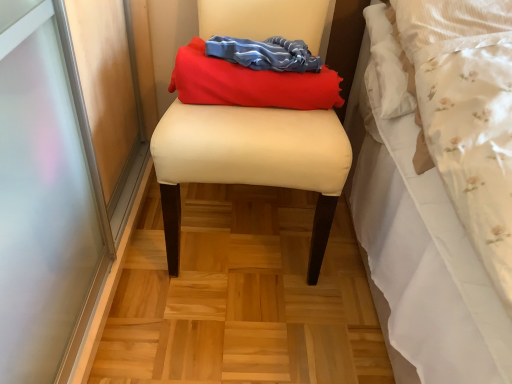
The width and height of the screenshot is (512, 384). I want to click on matte red fabric at center, so click(254, 74).

This screenshot has width=512, height=384. Describe the element at coordinates (254, 74) in the screenshot. I see `matte red fabric at center` at that location.

This screenshot has height=384, width=512. What do you see at coordinates (250, 160) in the screenshot?
I see `beige fabric stool at center` at bounding box center [250, 160].

The height and width of the screenshot is (384, 512). I want to click on beige fabric stool at center, so click(x=250, y=160).

Where is `matte red fabric at center`? The height and width of the screenshot is (384, 512). matte red fabric at center is located at coordinates (254, 74).

Which object is positioned more to the right, matte red fabric at center or beige fabric stool at center?

From the viewer's perspective, matte red fabric at center appears more on the right side.

Considering the positions of objects matte red fabric at center and beige fabric stool at center in the image provided, who is in front, matte red fabric at center or beige fabric stool at center?

beige fabric stool at center.

Considering the points (325, 108) and (321, 224), which point is behind, point (325, 108) or point (321, 224)?

The point (321, 224) is farther from the camera.

From the image's perspective, is matte red fabric at center positioned above or below beige fabric stool at center?

matte red fabric at center is above beige fabric stool at center.

From a real-world perspective, between matte red fabric at center and beige fabric stool at center, who is vertically lower?

beige fabric stool at center is physically lower.

Between matte red fabric at center and beige fabric stool at center, which one has larger width?

With larger width is beige fabric stool at center.

Which of these two, matte red fabric at center or beige fabric stool at center, stands shorter?

With less height is matte red fabric at center.

Considering the sizes of matte red fabric at center and beige fabric stool at center in the image, is matte red fabric at center bigger or smaller than beige fabric stool at center?

matte red fabric at center is smaller than beige fabric stool at center.

Is matte red fabric at center situated inside beige fabric stool at center or outside?

matte red fabric at center can be found inside beige fabric stool at center.

Would you consider matte red fabric at center to be distant from beige fabric stool at center?

matte red fabric at center is actually quite close to beige fabric stool at center.

Is matte red fabric at center oriented towards beige fabric stool at center?

Yes, matte red fabric at center is turned towards beige fabric stool at center.

Can you tell me how much matte red fabric at center and beige fabric stool at center differ in facing direction?

The angular difference between matte red fabric at center and beige fabric stool at center is 0.449 degrees.

How much distance is there between matte red fabric at center and beige fabric stool at center?

The distance of matte red fabric at center from beige fabric stool at center is 4.86 inches.

Identify the location of laundry that appears above the beige fabric stool at center (from the image's perspective). (254, 74).

From the picture: Which object is positioned more to the left, beige fabric stool at center or matte red fabric at center?

From the viewer's perspective, beige fabric stool at center appears more on the left side.

Is beige fabric stool at center closer to camera compared to matte red fabric at center?

That is True.

Between point (332, 179) and point (173, 79), which one is positioned in front?

The point (332, 179) is closer to the camera.

From the image's perspective, does beige fabric stool at center appear lower than matte red fabric at center?

Yes, from the image's perspective, beige fabric stool at center is beneath matte red fabric at center.

Looking at this image, from a real-world perspective, between beige fabric stool at center and matte red fabric at center, who is vertically lower?

In real-world perspective, beige fabric stool at center is lower.

From the picture: Which of these two, beige fabric stool at center or matte red fabric at center, is wider?

beige fabric stool at center.

Is beige fabric stool at center taller or shorter than matte red fabric at center?

beige fabric stool at center is taller than matte red fabric at center.

Is beige fabric stool at center bigger than matte red fabric at center?

Yes, beige fabric stool at center is bigger than matte red fabric at center.

Would you say matte red fabric at center is part of beige fabric stool at center's contents?

Yes, matte red fabric at center is a part of beige fabric stool at center.

Is beige fabric stool at center far from matte red fabric at center?

beige fabric stool at center is near matte red fabric at center, not far away.

Could you tell me if beige fabric stool at center is facing matte red fabric at center?

Yes, beige fabric stool at center faces towards matte red fabric at center.

How many degrees apart are the facing directions of beige fabric stool at center and matte red fabric at center?

0.449 degrees separate the facing orientations of beige fabric stool at center and matte red fabric at center.

Based on the photo, how far apart are beige fabric stool at center and matte red fabric at center?

The distance of beige fabric stool at center from matte red fabric at center is 4.86 inches.

Where is `furniture located underneath the matte red fabric at center (from a real-world perspective)`? This screenshot has height=384, width=512. furniture located underneath the matte red fabric at center (from a real-world perspective) is located at coordinates (250, 160).

Where is `laundry behind the beige fabric stool at center`? Image resolution: width=512 pixels, height=384 pixels. laundry behind the beige fabric stool at center is located at coordinates (254, 74).

I want to click on laundry located on the right of beige fabric stool at center, so click(x=254, y=74).